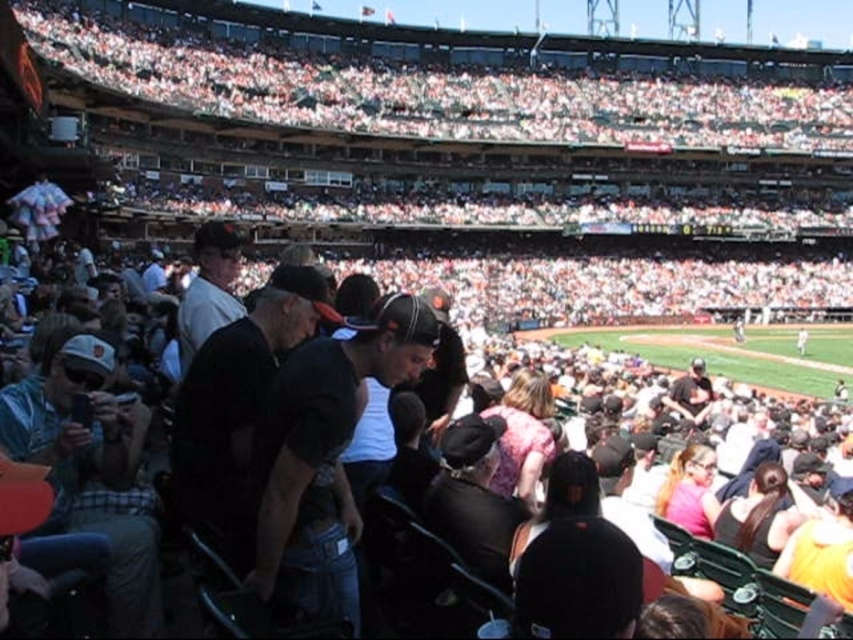
You are a photographer standing at the edge of the field and want to take a photo of the black cotton shirt at center and the dark gray baseball cap at center. Which object will appear larger in your photo?

The black cotton shirt at center will appear larger in the photo because it is closer to the viewer than the dark gray baseball cap at center.

You are standing at the point marked as point (131,401) in the baseball stadium. You want to throw a baseball to a friend who is standing 50 meters away from you. Is your friend within the distance you can throw the ball?

The distance between you and your friend is exactly 50.05 meters. Since the average throwing distance for an adult is around 30 meters, your friend is slightly out of reach. You may need to move closer or use a longer throw.